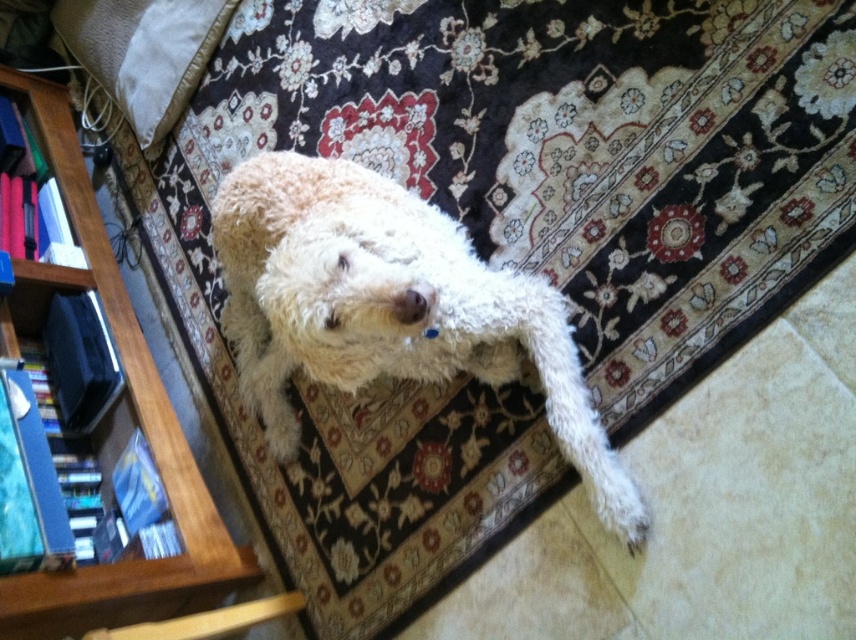
Question: Which point is farther from the camera taking this photo?

Choices:
 (A) (129, 76)
 (B) (402, 285)
 (C) (16, 628)

Answer: (A)

Question: Does white fluffy dog at center have a greater width compared to soft beige pillow at upper left?

Choices:
 (A) no
 (B) yes

Answer: (B)

Question: Which object is closer to the camera taking this photo?

Choices:
 (A) wooden bookshelf at left
 (B) soft beige pillow at upper left
 (C) white fluffy dog at center

Answer: (C)

Question: Is the position of wooden bookshelf at left more distant than that of soft beige pillow at upper left?

Choices:
 (A) no
 (B) yes

Answer: (A)

Question: Which point appears closest to the camera in this image?

Choices:
 (A) (168, 36)
 (B) (55, 172)

Answer: (B)

Question: Can you confirm if white fluffy dog at center is positioned to the right of wooden bookshelf at left?

Choices:
 (A) yes
 (B) no

Answer: (A)